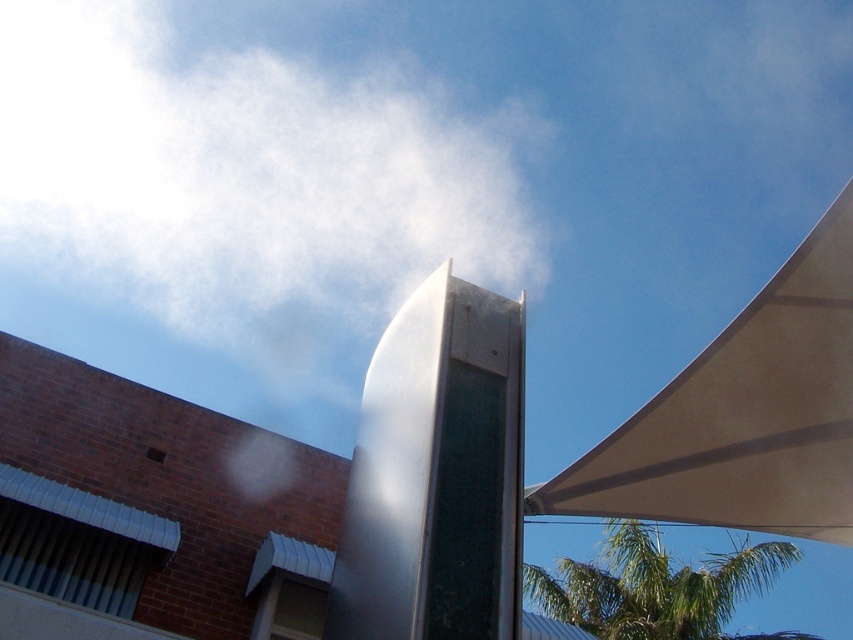
Question: Which point is closer to the camera taking this photo?

Choices:
 (A) (703, 410)
 (B) (698, 612)

Answer: (A)

Question: Does beige fabric canopy at upper right appear under green leafy palm tree at upper right?

Choices:
 (A) no
 (B) yes

Answer: (A)

Question: Does beige fabric canopy at upper right appear over green leafy palm tree at upper right?

Choices:
 (A) no
 (B) yes

Answer: (B)

Question: Does beige fabric canopy at upper right come behind green leafy palm tree at upper right?

Choices:
 (A) no
 (B) yes

Answer: (A)